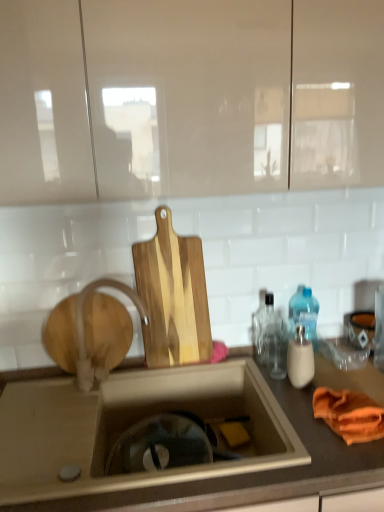
You are a GUI agent. You are given a task and a screenshot of the screen. Output one action in this format:
    pyautogui.click(x=<x>, y=<y>)
    Task: Click on the free space in front of transparent glass bottle at right, which is the 2th bottle in back-to-front order
    The image size is (384, 512).
    Given the screenshot: What is the action you would take?
    pyautogui.click(x=287, y=387)